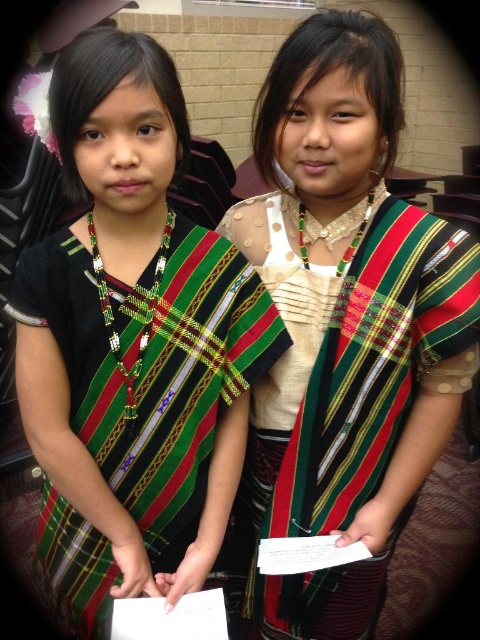
Does point (48, 444) lie in front of point (241, 600)?

That is True.

Can you confirm if matte black dress at left is positioned to the right of textured woven dress at center?

In fact, matte black dress at left is to the left of textured woven dress at center.

Between point (47, 305) and point (397, 204), which one is positioned in front?

Point (47, 305) is in front.

I want to click on matte black dress at left, so click(x=132, y=342).